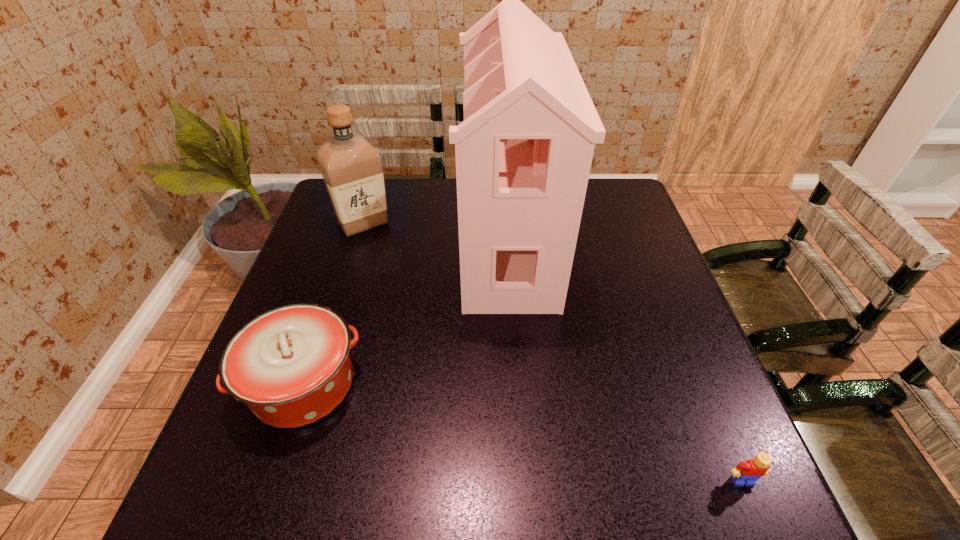
Find the location of a particular element. The height and width of the screenshot is (540, 960). vacant space situated 0.310m on the front-facing side of the third shortest object is located at coordinates [x=332, y=323].

Identify the location of vacant space situated 0.090m on the right of the second shortest object. This screenshot has width=960, height=540. (406, 384).

At what (x,y) coordinates should I click in order to perform the action: click on dollhouse that is at the far edge. Please return your answer as a coordinate pair (x, y). The image size is (960, 540). Looking at the image, I should click on (523, 153).

Locate an element on the screen. This screenshot has width=960, height=540. liquor present at the far edge is located at coordinates (351, 167).

The height and width of the screenshot is (540, 960). Identify the location of object present at the near edge. (746, 473).

Find the location of a particular element. liquor that is at the left edge is located at coordinates (351, 167).

The image size is (960, 540). Identify the location of casserole that is at the left edge. (291, 365).

Locate an element on the screen. The height and width of the screenshot is (540, 960). object located in the right edge section of the desktop is located at coordinates (746, 473).

The width and height of the screenshot is (960, 540). Find the location of `object that is positioned at the far left corner`. object that is positioned at the far left corner is located at coordinates (351, 167).

This screenshot has height=540, width=960. Find the location of `object situated at the near right corner`. object situated at the near right corner is located at coordinates (746, 473).